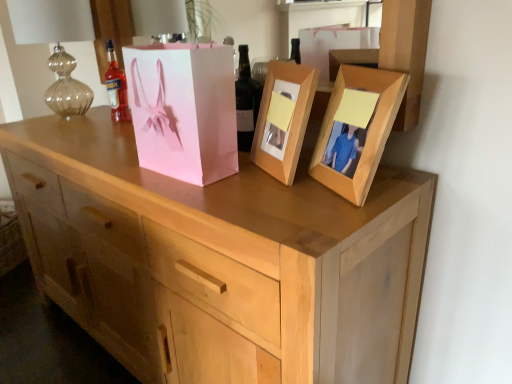
Locate an element on the screen. vacant space that is to the left of pink paper bag at center is located at coordinates (112, 168).